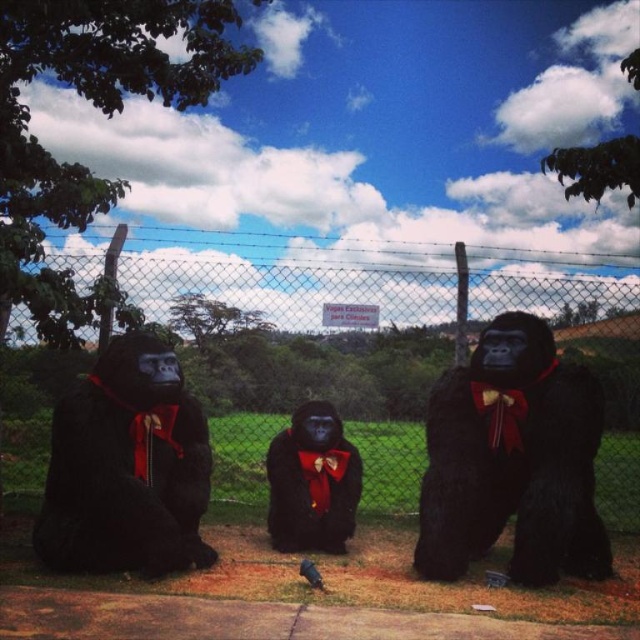
Question: Estimate the real-world distances between objects in this image. Which object is closer to the matte black gorilla at left?

Choices:
 (A) velvet black gorilla at center
 (B) black matte gorilla at right
 (C) wire mesh fence at center

Answer: (A)

Question: Is wire mesh fence at center further to the viewer compared to matte black gorilla at left?

Choices:
 (A) no
 (B) yes

Answer: (B)

Question: Is wire mesh fence at center behind matte black gorilla at left?

Choices:
 (A) yes
 (B) no

Answer: (A)

Question: From the image, what is the correct spatial relationship of black matte gorilla at right in relation to matte black gorilla at left?

Choices:
 (A) below
 (B) above

Answer: (A)

Question: Among these points, which one is farthest from the camera?

Choices:
 (A) (470, 529)
 (B) (348, 454)
 (C) (76, 538)

Answer: (B)

Question: Estimate the real-world distances between objects in this image. Which object is closer to the wire mesh fence at center?

Choices:
 (A) black matte gorilla at right
 (B) matte black gorilla at left
 (C) velvet black gorilla at center

Answer: (C)